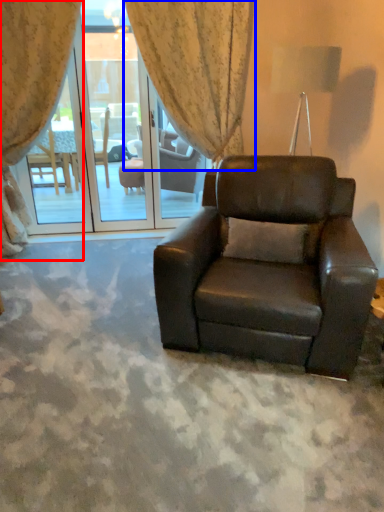
Question: Among these objects, which one is nearest to the camera, curtain (highlighted by a red box) or curtain (highlighted by a blue box)?

Choices:
 (A) curtain
 (B) curtain

Answer: (A)